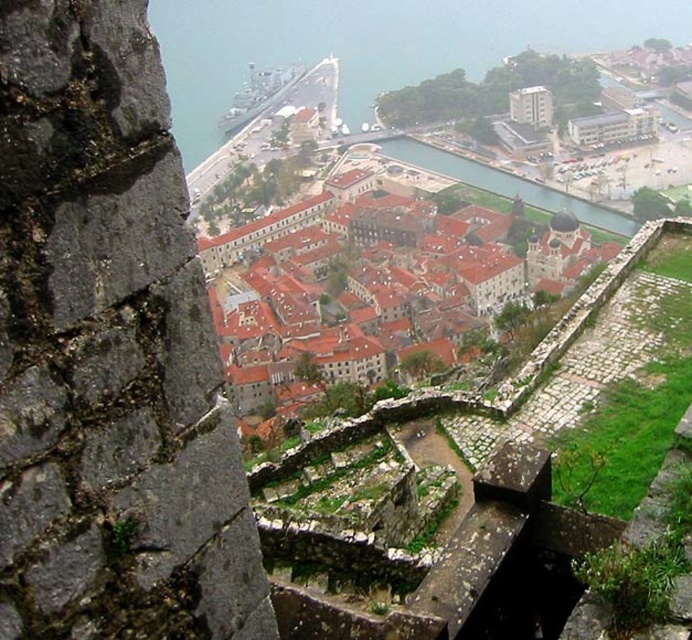
Does brown tiled roofs at center appear on the right side of clear water at center?

No, brown tiled roofs at center is not to the right of clear water at center.

Does brown tiled roofs at center have a lesser height compared to clear water at center?

No.

Is point (493, 253) in front of point (581, 212)?

Yes, it is in front of point (581, 212).

Identify the location of brown tiled roofs at center. (372, 280).